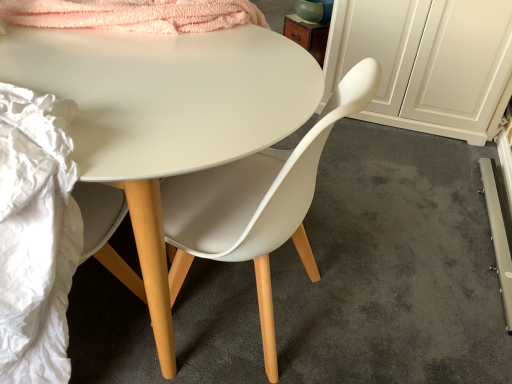
Question: Is white matte cabinet at right at the left side of matte white chair at center?

Choices:
 (A) no
 (B) yes

Answer: (A)

Question: Is white matte cabinet at right next to matte white chair at center and touching it?

Choices:
 (A) no
 (B) yes

Answer: (A)

Question: Is white matte cabinet at right at the right side of matte white chair at center?

Choices:
 (A) no
 (B) yes

Answer: (B)

Question: Can you confirm if white matte cabinet at right is smaller than matte white chair at center?

Choices:
 (A) yes
 (B) no

Answer: (B)

Question: From a real-world perspective, is white matte cabinet at right below matte white chair at center?

Choices:
 (A) yes
 (B) no

Answer: (A)

Question: Which is correct: matte white chair at center is inside white matte cabinet at right, or outside of it?

Choices:
 (A) inside
 (B) outside

Answer: (B)

Question: Considering the positions of point (99, 331) and point (352, 46), is point (99, 331) closer or farther from the camera than point (352, 46)?

Choices:
 (A) closer
 (B) farther

Answer: (A)

Question: From the image's perspective, relative to white matte cabinet at right, is matte white chair at center above or below?

Choices:
 (A) below
 (B) above

Answer: (B)

Question: Considering their positions, is matte white chair at center located in front of or behind white matte cabinet at right?

Choices:
 (A) behind
 (B) front

Answer: (B)

Question: In the image, is matte white chair at center positioned in front of or behind white matte desk at center?

Choices:
 (A) behind
 (B) front

Answer: (A)

Question: Considering the positions of matte white chair at center and white matte desk at center in the image, is matte white chair at center taller or shorter than white matte desk at center?

Choices:
 (A) short
 (B) tall

Answer: (A)

Question: Which is correct: matte white chair at center is inside white matte desk at center, or outside of it?

Choices:
 (A) inside
 (B) outside

Answer: (B)

Question: In the image, is matte white chair at center on the left side or the right side of white matte desk at center?

Choices:
 (A) right
 (B) left

Answer: (A)

Question: Based on their positions, is matte white chair at center located to the left or right of matte white chair at center?

Choices:
 (A) left
 (B) right

Answer: (A)

Question: Which is correct: matte white chair at center is inside matte white chair at center, or outside of it?

Choices:
 (A) outside
 (B) inside

Answer: (A)